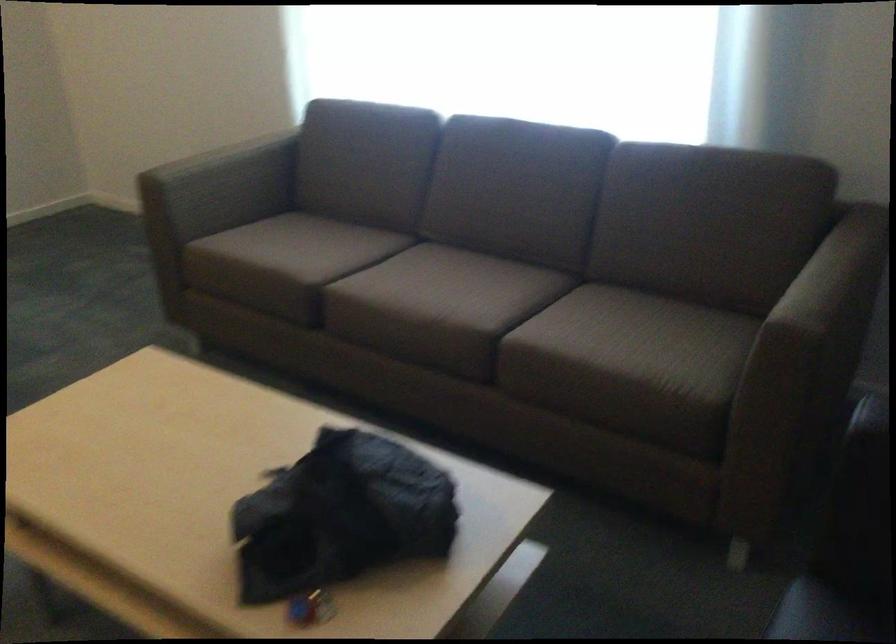
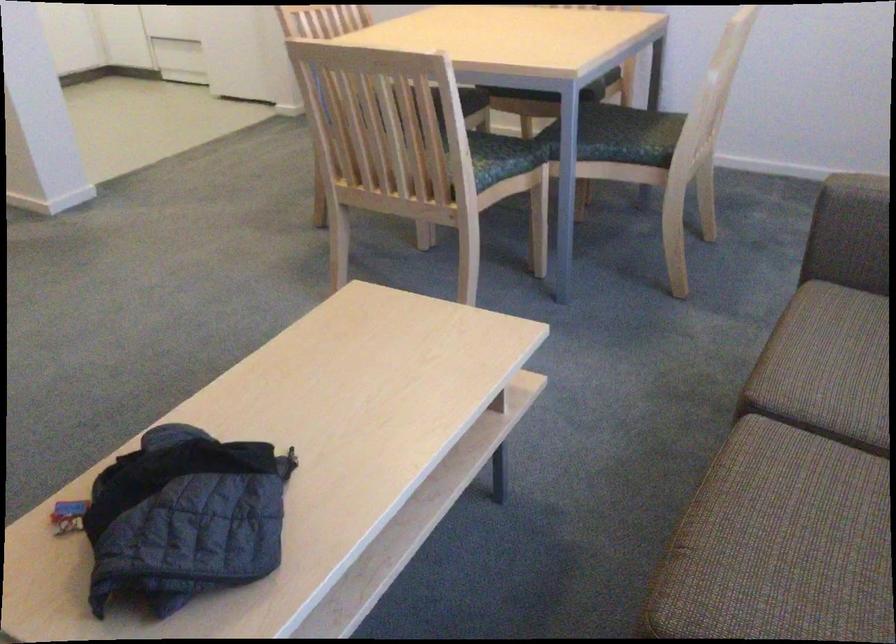
In the second image, find the point that corresponds to [392,287] in the first image.

(794, 489)